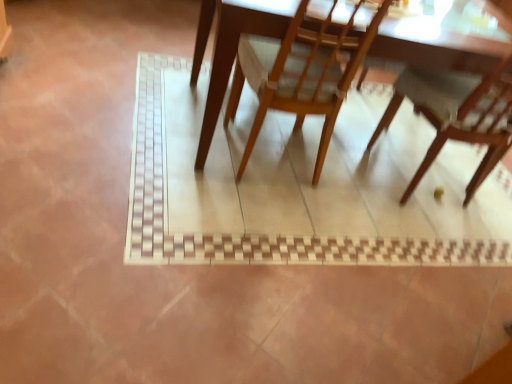
I want to click on free space in front of wooden table at center, so click(242, 270).